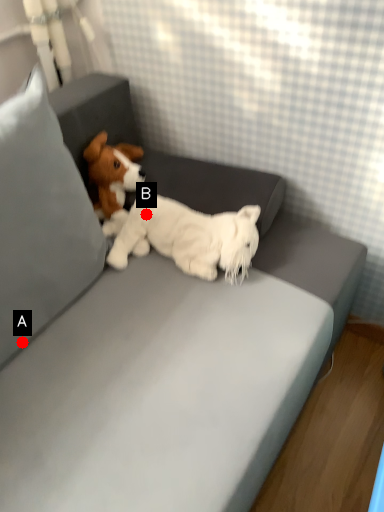
Question: Two points are circled on the image, labeled by A and B beside each circle. Among these points, which one is farthest from the camera?

Choices:
 (A) A is further
 (B) B is further

Answer: (B)